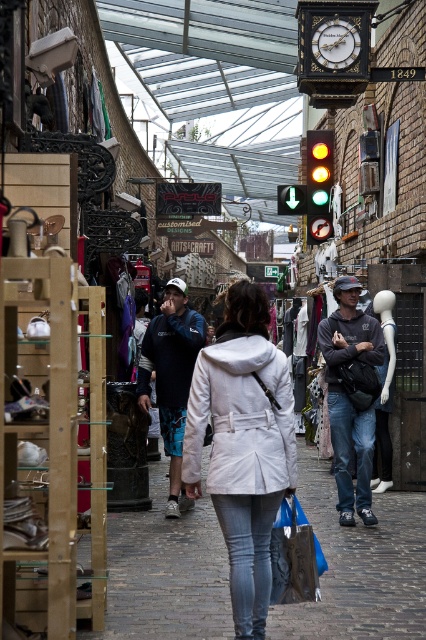
You are a customer in the market and want to buy both the matte gray hoodie at center and the green glass traffic light at center. Which item is closer to your right hand if you are facing the stalls?

The matte gray hoodie at center is positioned on the right side of the green glass traffic light at center, so it is closer to your right hand when facing the stalls.

You are a customer in the market and want to buy the matte gray hoodie at center. The store owner says you need to stand under the green glass traffic light at center to try it on. Can you do that?

The matte gray hoodie at center is positioned under the green glass traffic light at center, so yes, you can stand under the green glass traffic light at center to try on the matte gray hoodie at center.